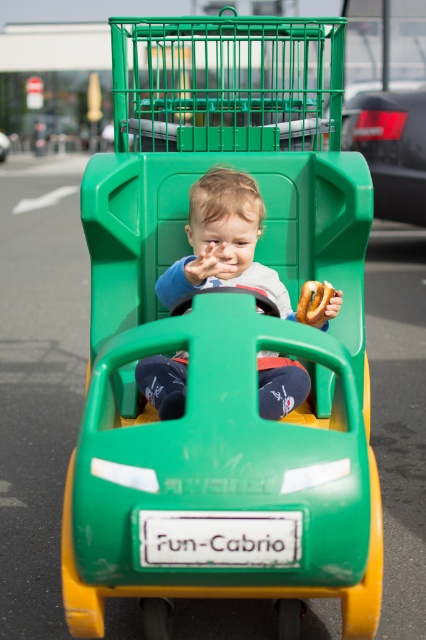
Question: Which point is farther to the camera?

Choices:
 (A) matte green toddler at center
 (B) green matte car at center

Answer: (B)

Question: Is matte green toddler at center wider than golden brown pretzel at center?

Choices:
 (A) yes
 (B) no

Answer: (A)

Question: Which of the following is the closest to the observer?

Choices:
 (A) (173, 276)
 (B) (305, 285)

Answer: (B)

Question: Which point appears farthest from the camera in this image?

Choices:
 (A) (304, 289)
 (B) (224, 172)

Answer: (B)

Question: Does green matte car at center appear on the left side of golden brown pretzel at center?

Choices:
 (A) yes
 (B) no

Answer: (B)

Question: Is matte green toddler at center below golden brown pretzel at center?

Choices:
 (A) yes
 (B) no

Answer: (B)